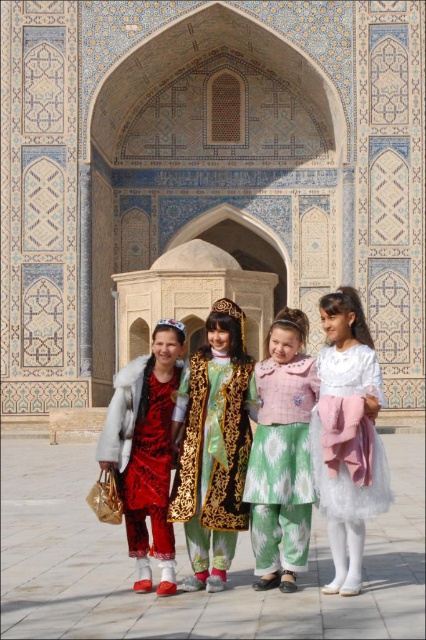
You are a photographer planning to take a group photo of the girls in front of the monument. You need to ensure that both the white tulle dress at center and the pastel pink fabric dress at center are clearly visible. Given their sizes, which dress might you position closer to the camera to ensure visibility?

The white tulle dress at center is bigger than the pastel pink fabric dress at center, so positioning the white tulle dress at center closer to the camera would ensure its visibility without overshadowing the smaller pastel pink fabric dress at center.

You are a photographer trying to capture the two girls in the center of the image wearing the white tulle dress at center and the pastel pink fabric dress at center. Which girl is standing in front of the other?

The white tulle dress at center is positioned over pastel pink fabric dress at center, so the girl wearing the white tulle dress at center is standing in front of the girl in the pastel pink fabric dress at center.